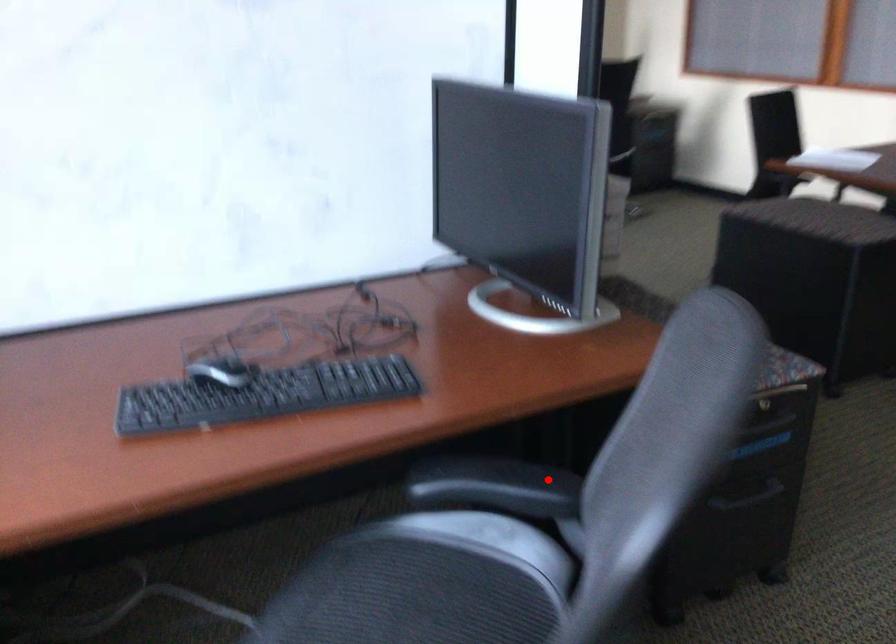
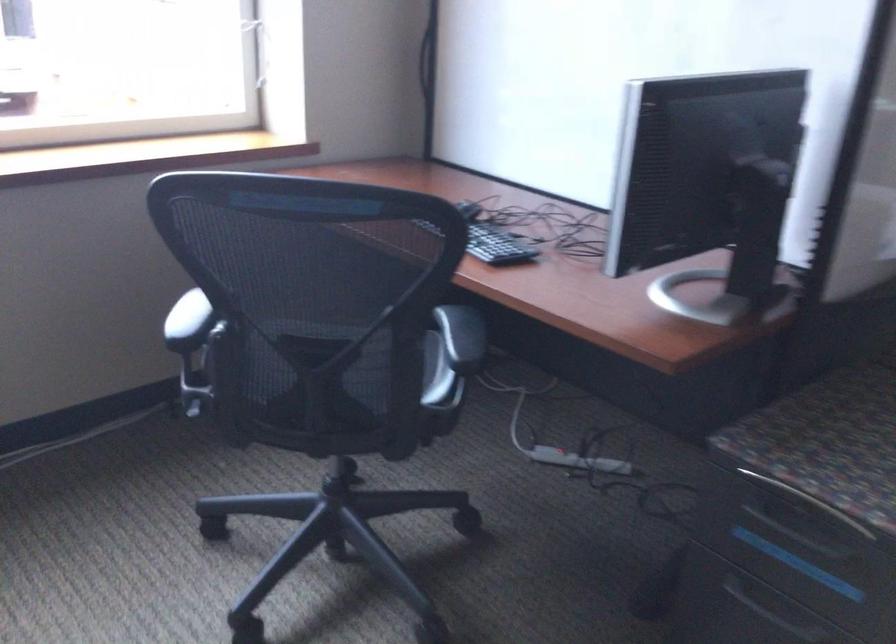
Question: A red point is marked in image1. In image2, is the corresponding 3D point closer to the camera or farther? Reply with the corresponding letter.

Choices:
 (A) The corresponding 3D point is closer.
 (B) The corresponding 3D point is farther.

Answer: (B)